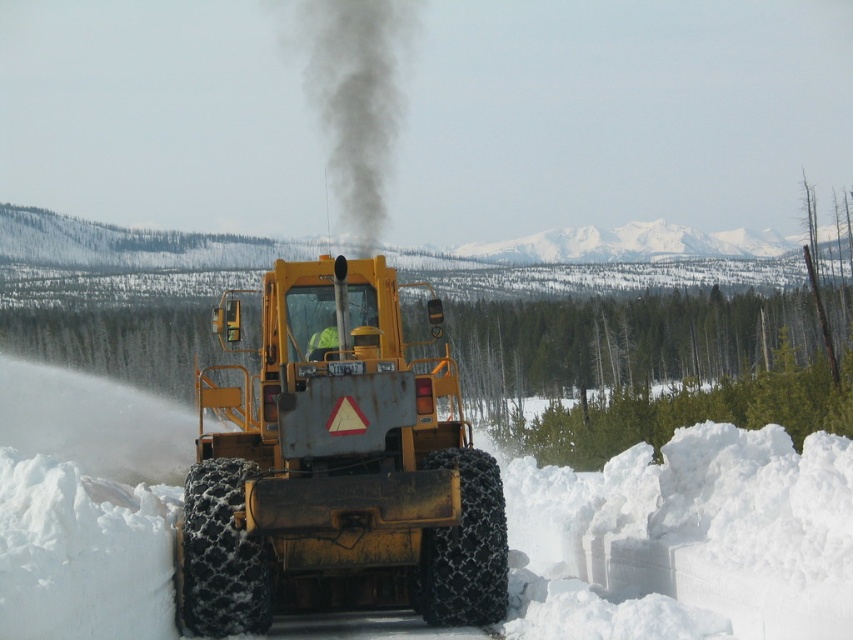
You are a delivery driver trying to navigate through the snowy area. You see the white powdery snow at center and the black smoke at center. Which one is wider from your perspective?

The white powdery snow at center has a lesser width compared to black smoke at center, so the black smoke at center is wider.

You are a delivery driver trying to reach a cabin located behind the yellow metallic tractor at center. The white powdery snow at center is blocking your path. Can you drive through the snow to reach the cabin?

The white powdery snow at center is positioned under the yellow metallic tractor at center, which means the tractor is on top of the snow. Since the tractor is able to plow through the snow, you can drive through the snow to reach the cabin as the tractor has already cleared a path.

You are standing at the point marked as point (202, 435) in the snowy landscape. The snowplow is currently 11.45 meters away from you. If the snowplow moves directly towards you at a speed of 5 meters per second, how many seconds will it take for the snowplow to reach you?

The snowplow is 11.45 meters away from you and moving towards you at 5 meters per second. To calculate the time it takes to reach you, divide the distance by the speed. 11.45 meters divided by 5 meters per second equals approximately 2.29 seconds. Therefore, the snowplow will reach you in about 2.29 seconds.